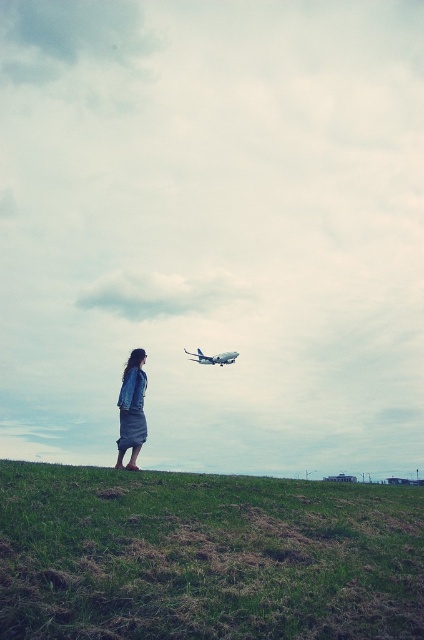
Does green grassy hill at lower center have a lesser width compared to denim jacket at lower left?

Incorrect, green grassy hill at lower center's width is not less than denim jacket at lower left's.

Can you confirm if green grassy hill at lower center is positioned below denim jacket at lower left?

Indeed, green grassy hill at lower center is positioned under denim jacket at lower left.

Does point (178, 525) come in front of point (141, 384)?

Yes, point (178, 525) is in front of point (141, 384).

The width and height of the screenshot is (424, 640). Identify the location of green grassy hill at lower center. (206, 556).

Does denim jacket at lower left have a greater width compared to white matte airplane at center?

No.

Is denim jacket at lower left closer to camera compared to white matte airplane at center?

That is True.

Is point (122, 435) positioned behind point (189, 356)?

No, it is in front of (189, 356).

Image resolution: width=424 pixels, height=640 pixels. Find the location of `denim jacket at lower left`. denim jacket at lower left is located at coordinates (131, 408).

Can you confirm if green grassy hill at lower center is positioned above white matte airplane at center?

Incorrect, green grassy hill at lower center is not positioned above white matte airplane at center.

Who is higher up, green grassy hill at lower center or white matte airplane at center?

white matte airplane at center

Locate an element on the screen. This screenshot has height=640, width=424. green grassy hill at lower center is located at coordinates (206, 556).